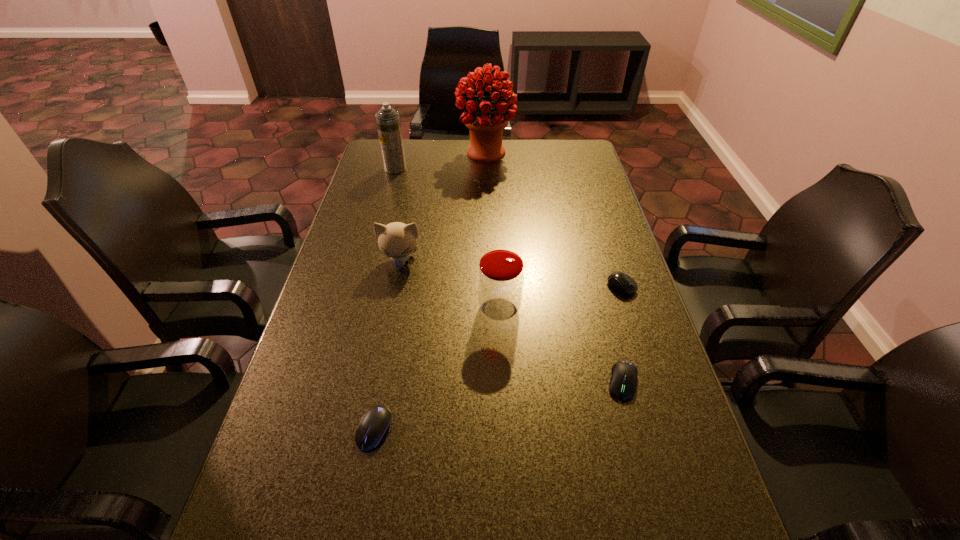
Identify the location of free space located 0.360m on the right of the aerosol can. The image size is (960, 540). (501, 168).

You are a GUI agent. You are given a task and a screenshot of the screen. Output one action in this format:
    pyautogui.click(x=<x>, y=<y>)
    Task: Click on the vacant point located on the front of the jar
    This screenshot has width=960, height=540.
    Given the screenshot: What is the action you would take?
    pyautogui.click(x=503, y=395)

This screenshot has height=540, width=960. Find the location of `vacant area situated 0.290m on the face of the fifth nearest object`. vacant area situated 0.290m on the face of the fifth nearest object is located at coordinates (382, 355).

The width and height of the screenshot is (960, 540). Identify the location of vacant space located 0.300m on the left of the farthest computer mouse. (499, 287).

In order to click on free space located 0.140m on the back of the sixth farthest object in this screenshot , I will do `click(606, 317)`.

At what (x,y) coordinates should I click in order to perform the action: click on free region located on the front of the nearest object. Please return your answer as a coordinate pair (x, y). The height and width of the screenshot is (540, 960). Looking at the image, I should click on (366, 477).

Where is `bouquet located at the far edge`? bouquet located at the far edge is located at coordinates (486, 123).

Identify the location of aerosol can that is at the far edge. click(x=388, y=121).

Where is `aerosol can situated at the left edge`? aerosol can situated at the left edge is located at coordinates (388, 121).

You are a GUI agent. You are given a task and a screenshot of the screen. Output one action in this format:
    pyautogui.click(x=<x>, y=<y>)
    Task: Click on the kitten at the left edge
    This screenshot has width=960, height=540.
    Given the screenshot: What is the action you would take?
    pyautogui.click(x=396, y=240)